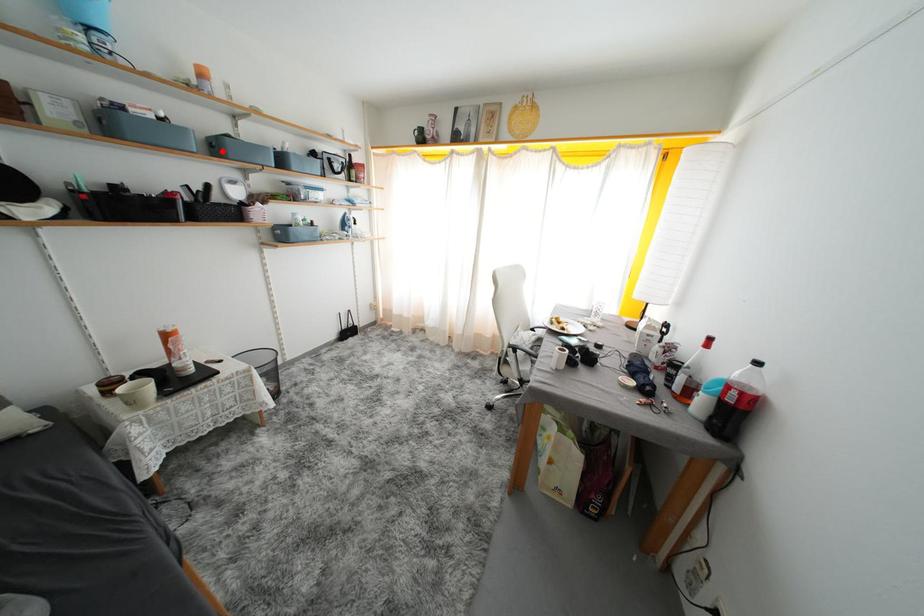
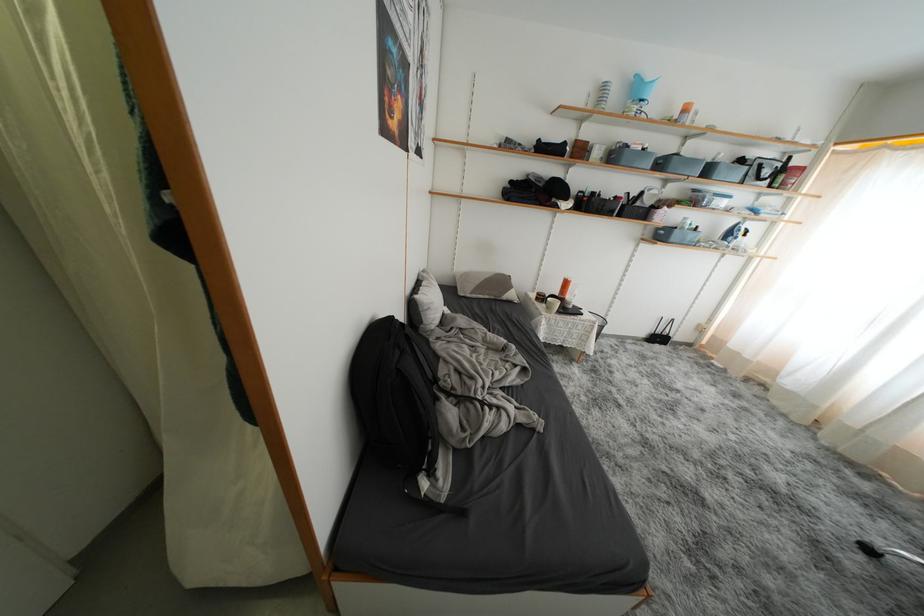
The point at the highlighted location is marked in the first image. Where is the corresponding point in the second image?

(667, 168)